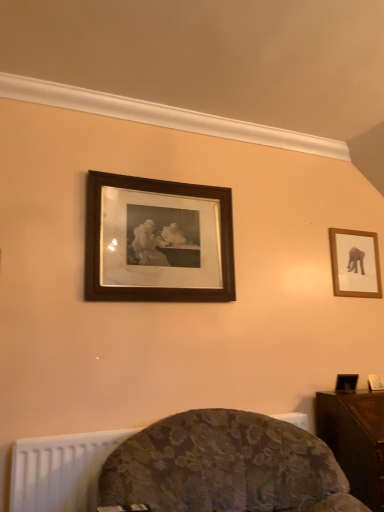
Question: Can you confirm if velvet floral chair at lower center is shorter than wooden frame at upper right, the 2th picture frame when ordered from left to right?

Choices:
 (A) no
 (B) yes

Answer: (A)

Question: Considering the relative positions of velvet floral chair at lower center and wooden frame at upper right, the 2th picture frame when ordered from left to right, in the image provided, is velvet floral chair at lower center behind wooden frame at upper right, the 2th picture frame when ordered from left to right,?

Choices:
 (A) yes
 (B) no

Answer: (B)

Question: Is velvet floral chair at lower center looking in the opposite direction of wooden frame at upper right, which is the first picture frame from back to front?

Choices:
 (A) yes
 (B) no

Answer: (B)

Question: From the image's perspective, is velvet floral chair at lower center on top of wooden frame at upper right, which is the first picture frame from back to front?

Choices:
 (A) yes
 (B) no

Answer: (B)

Question: From a real-world perspective, does velvet floral chair at lower center sit lower than wooden frame at upper right, the 1th picture frame when ordered from right to left?

Choices:
 (A) yes
 (B) no

Answer: (A)

Question: In terms of size, does black wood picture frame at upper center, arranged as the 2th picture frame when viewed from the back, appear bigger or smaller than wooden frame at upper right, which is the first picture frame from back to front?

Choices:
 (A) small
 (B) big

Answer: (B)

Question: Considering their positions, is black wood picture frame at upper center, arranged as the 2th picture frame when viewed from the back, located in front of or behind wooden frame at upper right, the 2th picture frame when ordered from left to right?

Choices:
 (A) behind
 (B) front

Answer: (B)

Question: From a real-world perspective, is black wood picture frame at upper center, arranged as the 2th picture frame when viewed from the back, physically located above or below wooden frame at upper right, which is the first picture frame from back to front?

Choices:
 (A) above
 (B) below

Answer: (A)

Question: From the image's perspective, is black wood picture frame at upper center, arranged as the 2th picture frame when viewed from the back, positioned above or below wooden frame at upper right, the 2th picture frame when ordered from left to right?

Choices:
 (A) below
 (B) above

Answer: (B)

Question: Considering their positions, is black wood picture frame at upper center, which appears as the 1th picture frame when viewed from the front, located in front of or behind dark wood table at lower right?

Choices:
 (A) front
 (B) behind

Answer: (B)

Question: Is point (218, 228) positioned closer to the camera than point (360, 489)?

Choices:
 (A) farther
 (B) closer

Answer: (A)

Question: From a real-world perspective, is black wood picture frame at upper center, arranged as the 2th picture frame when viewed from the back, positioned above or below dark wood table at lower right?

Choices:
 (A) above
 (B) below

Answer: (A)

Question: From the image's perspective, is black wood picture frame at upper center, the second picture frame when ordered from right to left, positioned above or below dark wood table at lower right?

Choices:
 (A) below
 (B) above

Answer: (B)

Question: In terms of size, does wooden frame at upper right, which is the first picture frame from back to front, appear bigger or smaller than dark wood table at lower right?

Choices:
 (A) small
 (B) big

Answer: (A)

Question: Is wooden frame at upper right, which is the first picture frame from back to front, taller or shorter than dark wood table at lower right?

Choices:
 (A) short
 (B) tall

Answer: (A)